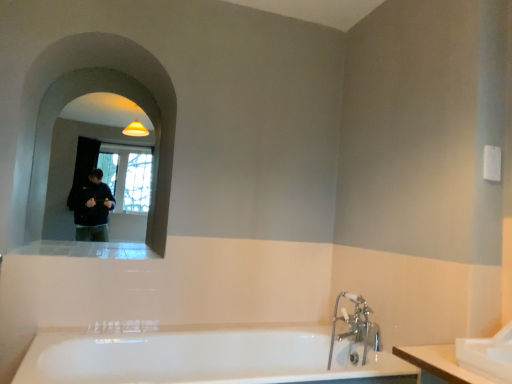
Question: Is matte glass mirror at upper left further to the viewer compared to chrome metallic faucet at lower right?

Choices:
 (A) no
 (B) yes

Answer: (B)

Question: Can you confirm if matte glass mirror at upper left is bigger than chrome metallic faucet at lower right?

Choices:
 (A) yes
 (B) no

Answer: (A)

Question: Can you confirm if matte glass mirror at upper left is shorter than chrome metallic faucet at lower right?

Choices:
 (A) no
 (B) yes

Answer: (A)

Question: Is matte glass mirror at upper left beside chrome metallic faucet at lower right?

Choices:
 (A) no
 (B) yes

Answer: (A)

Question: From the image's perspective, does matte glass mirror at upper left appear lower than chrome metallic faucet at lower right?

Choices:
 (A) no
 (B) yes

Answer: (A)

Question: Choose the correct answer: Is chrome metallic faucet at lower right inside white glossy sink at lower right or outside it?

Choices:
 (A) outside
 (B) inside

Answer: (A)

Question: Is point (373, 329) closer or farther from the camera than point (496, 336)?

Choices:
 (A) farther
 (B) closer

Answer: (A)

Question: From a real-world perspective, relative to white glossy sink at lower right, is chrome metallic faucet at lower right vertically above or below?

Choices:
 (A) above
 (B) below

Answer: (B)

Question: In the image, is chrome metallic faucet at lower right positioned in front of or behind white glossy sink at lower right?

Choices:
 (A) front
 (B) behind

Answer: (B)

Question: In the image, is matte glass mirror at upper left positioned in front of or behind chrome metallic faucet at lower right?

Choices:
 (A) front
 (B) behind

Answer: (B)

Question: From a real-world perspective, is matte glass mirror at upper left positioned above or below chrome metallic faucet at lower right?

Choices:
 (A) above
 (B) below

Answer: (A)

Question: In the image, is matte glass mirror at upper left on the left side or the right side of chrome metallic faucet at lower right?

Choices:
 (A) left
 (B) right

Answer: (A)

Question: Considering the positions of matte glass mirror at upper left and chrome metallic faucet at lower right in the image, is matte glass mirror at upper left taller or shorter than chrome metallic faucet at lower right?

Choices:
 (A) short
 (B) tall

Answer: (B)

Question: Visually, is chrome metallic faucet at lower right positioned to the left or to the right of white glossy bathtub at lower center?

Choices:
 (A) left
 (B) right

Answer: (B)

Question: Does point (365, 319) appear closer or farther from the camera than point (103, 339)?

Choices:
 (A) closer
 (B) farther

Answer: (B)